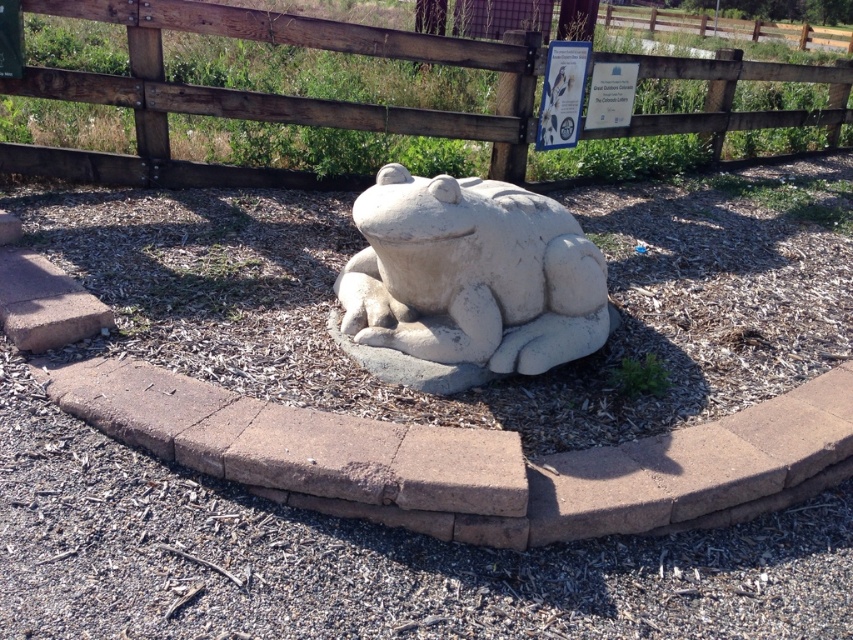
You are standing in front of the stone frog sculpture and want to touch the wooden fence at upper center. Based on the distance provided, can you reach it without moving your feet?

The wooden fence at upper center is 17.49 feet away from the viewer. Since this distance is greater than an average person can reach without moving, you cannot touch it without moving your feet.

You are standing in front of the white stone frog at center and want to walk towards the wooden fence at upper center. In which direction should you move relative to the frog?

The wooden fence at upper center is positioned on the right side of the white stone frog at center, so you should move to the right relative to the frog to reach the wooden fence at upper center.